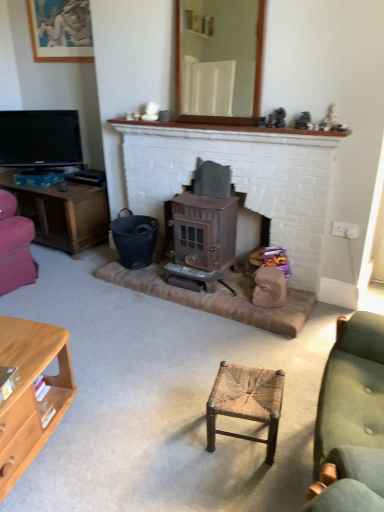
Describe the element at coordinates (203, 229) in the screenshot. I see `bronze textured wood burning stove at center` at that location.

This screenshot has height=512, width=384. Describe the element at coordinates (219, 60) in the screenshot. I see `clear glass mirror at upper center` at that location.

Where is `matte black tv at left`? matte black tv at left is located at coordinates (40, 139).

You are a GUI agent. You are given a task and a screenshot of the screen. Output one action in this format:
    pyautogui.click(x=<x>, y=<y>)
    Task: Click on the matte wooden picture frame at upper left
    
    Given the screenshot: What is the action you would take?
    pyautogui.click(x=60, y=30)

Measure the distance between matte wooden picture frame at upper left and camera.

matte wooden picture frame at upper left is 3.14 meters from camera.

In the scene shown: In order to face woven wood stool at center, should I rotate leftwards or rightwards?

You should rotate right by 7.456 degrees.

Describe the element at coordinates (230, 133) in the screenshot. The height and width of the screenshot is (512, 384). I see `white painted wood mantle at upper center` at that location.

Where is `bronze textured wood burning stove at center`? This screenshot has height=512, width=384. bronze textured wood burning stove at center is located at coordinates (203, 229).

In the scene shown: Considering the sizes of objects light brown wood cabinet at lower left and bronze metallic stove at center in the image provided, who is thinner, light brown wood cabinet at lower left or bronze metallic stove at center?

bronze metallic stove at center.

Considering the positions of objects light brown wood cabinet at lower left and bronze metallic stove at center in the image provided, who is more to the right, light brown wood cabinet at lower left or bronze metallic stove at center?

bronze metallic stove at center.

Is light brown wood cabinet at lower left smaller than bronze metallic stove at center?

No.

Can you tell me how much light brown wood cabinet at lower left and bronze metallic stove at center differ in facing direction?

105 degrees.

Considering the positions of point (224, 198) and point (263, 138), is point (224, 198) closer or farther from the camera than point (263, 138)?

Clearly, point (224, 198) is more distant from the camera than point (263, 138).

Is bronze textured wood burning stove at center in contact with bronze metallic stove at center?

No, bronze textured wood burning stove at center is not with bronze metallic stove at center.

Who is shorter, bronze textured wood burning stove at center or bronze metallic stove at center?

Standing shorter between the two is bronze textured wood burning stove at center.

How many degrees apart are the facing directions of bronze textured wood burning stove at center and bronze metallic stove at center?

bronze textured wood burning stove at center and bronze metallic stove at center are facing 0.862 degrees away from each other.

Can you confirm if white painted wood mantle at upper center is positioned to the left of bronze textured wood burning stove at center?

No, white painted wood mantle at upper center is not to the left of bronze textured wood burning stove at center.

Considering the sizes of objects white painted wood mantle at upper center and bronze textured wood burning stove at center in the image provided, who is thinner, white painted wood mantle at upper center or bronze textured wood burning stove at center?

white painted wood mantle at upper center is thinner.

From the image's perspective, would you say white painted wood mantle at upper center is positioned over bronze textured wood burning stove at center?

Yes, from the image's perspective, white painted wood mantle at upper center is over bronze textured wood burning stove at center.

Based on the photo, is black plastic bucket at lower left outside of clear glass mirror at upper center?

Yes, black plastic bucket at lower left is located beyond the bounds of clear glass mirror at upper center.

Is black plastic bucket at lower left looking in the opposite direction of clear glass mirror at upper center?

No.

From the image's perspective, is black plastic bucket at lower left above clear glass mirror at upper center?

No, from the image's perspective, black plastic bucket at lower left is not on top of clear glass mirror at upper center.

In the scene shown: Considering the positions of objects black plastic bucket at lower left and clear glass mirror at upper center in the image provided, who is more to the right, black plastic bucket at lower left or clear glass mirror at upper center?

clear glass mirror at upper center.

Would you say black plastic bucket at lower left is outside matte wooden picture frame at upper left?

black plastic bucket at lower left is positioned outside matte wooden picture frame at upper left.

Does black plastic bucket at lower left turn towards matte wooden picture frame at upper left?

No.

Find the location of `trash bin/can that is below the matte wooden picture frame at upper left (from the image's perspective)`. trash bin/can that is below the matte wooden picture frame at upper left (from the image's perspective) is located at coordinates (134, 239).

Is the position of black plastic bucket at lower left less distant than that of matte wooden picture frame at upper left?

Yes, it is in front of matte wooden picture frame at upper left.

Is matte wooden picture frame at upper left surrounding black plastic bucket at lower left?

That's incorrect, black plastic bucket at lower left is not inside matte wooden picture frame at upper left.

Is matte wooden picture frame at upper left not close to black plastic bucket at lower left?

Absolutely, matte wooden picture frame at upper left is distant from black plastic bucket at lower left.

From the image's perspective, which one is positioned higher, matte wooden picture frame at upper left or black plastic bucket at lower left?

matte wooden picture frame at upper left appears higher in the image.

Is matte wooden picture frame at upper left facing towards black plastic bucket at lower left?

No, matte wooden picture frame at upper left does not turn towards black plastic bucket at lower left.

Which object is further away from the camera taking this photo, matte wooden picture frame at upper left or clear glass mirror at upper center?

matte wooden picture frame at upper left is behind.

Is matte wooden picture frame at upper left next to clear glass mirror at upper center?

matte wooden picture frame at upper left and clear glass mirror at upper center are clearly separated.

From the image's perspective, which one is positioned higher, matte wooden picture frame at upper left or clear glass mirror at upper center?

matte wooden picture frame at upper left appears higher in the image.

Visually, is matte wooden picture frame at upper left positioned to the left or to the right of clear glass mirror at upper center?

In the image, matte wooden picture frame at upper left appears on the left side of clear glass mirror at upper center.

The image size is (384, 512). Identify the location of cabinetry located underneath the bronze metallic stove at center (from a real-world perspective). (30, 392).

At what (x,y) coordinates should I click in order to perform the action: click on wood burning stove behind the bronze metallic stove at center. Please return your answer as a coordinate pair (x, y). The image size is (384, 512). Looking at the image, I should click on (203, 229).

Looking at this image, based on their spatial positions, is green fabric couch at right or light brown wood cabinet at lower left closer to matte wooden picture frame at upper left?

light brown wood cabinet at lower left lies closer to matte wooden picture frame at upper left than the other object.

Looking at the image, which one is located further to woven wood stool at center, light brown wood cabinet at lower left or bronze textured wood burning stove at center?

bronze textured wood burning stove at center lies further to woven wood stool at center than the other object.

When comparing their distances from matte black tv at left, does light brown wood cabinet at lower left or bronze metallic stove at center seem further?

light brown wood cabinet at lower left is further to matte black tv at left.

Considering their positions, is woven wood stool at center positioned closer to white painted wood mantle at upper center than light brown wood cabinet at lower left?

The object closer to white painted wood mantle at upper center is woven wood stool at center.

Based on their spatial positions, is bronze textured wood burning stove at center or black plastic bucket at lower left closer to green fabric couch at right?

bronze textured wood burning stove at center is closer to green fabric couch at right.

Looking at the image, which one is located further to green fabric couch at right, bronze textured wood burning stove at center or white painted wood mantle at upper center?

white painted wood mantle at upper center lies further to green fabric couch at right than the other object.

From the image, which object appears to be nearer to matte black tv at left, clear glass mirror at upper center or bronze metallic stove at center?

bronze metallic stove at center lies closer to matte black tv at left than the other object.

Based on their spatial positions, is matte wooden picture frame at upper left or bronze textured wood burning stove at center further from clear glass mirror at upper center?

matte wooden picture frame at upper left.

Locate an element on the screen. Image resolution: width=384 pixels, height=512 pixels. fireplace between white painted wood mantle at upper center and light brown wood cabinet at lower left in the vertical direction is located at coordinates (242, 178).

Identify the location of fireplace positioned between woven wood stool at center and bronze textured wood burning stove at center from near to far. The image size is (384, 512). (242, 178).

Image resolution: width=384 pixels, height=512 pixels. In order to click on television between matte wooden picture frame at upper left and bronze textured wood burning stove at center from top to bottom in this screenshot , I will do `click(40, 139)`.

This screenshot has width=384, height=512. Find the location of `mirror between green fabric couch at right and matte black tv at left along the z-axis`. mirror between green fabric couch at right and matte black tv at left along the z-axis is located at coordinates (219, 60).